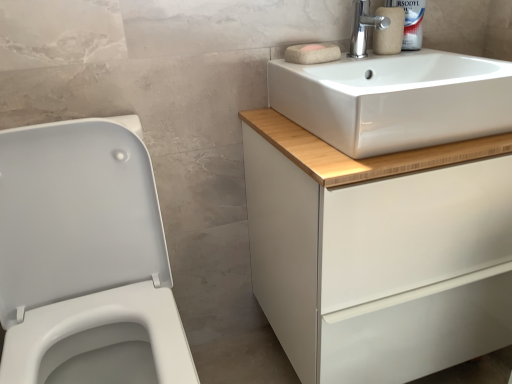
What do you see at coordinates (378, 252) in the screenshot?
I see `white matte cabinet at upper right` at bounding box center [378, 252].

Describe the element at coordinates (411, 22) in the screenshot. The width and height of the screenshot is (512, 384). I see `white glossy plastic bottle at upper right` at that location.

Measure the distance between point (312, 55) and camera.

They are 1.03 meters apart.

This screenshot has width=512, height=384. Describe the element at coordinates (395, 99) in the screenshot. I see `white ceramic sink at upper right` at that location.

This screenshot has width=512, height=384. In order to click on white ceramic sink at upper right in this screenshot , I will do `click(395, 99)`.

Locate an element on the screen. white matte soap at upper center, acting as the 1th soap starting from the back is located at coordinates (312, 47).

Between polished chrome tap at upper right and white ceramic sink at upper right, which one appears on the right side from the viewer's perspective?

From the viewer's perspective, white ceramic sink at upper right appears more on the right side.

Can you confirm if polished chrome tap at upper right is smaller than white ceramic sink at upper right?

Correct, polished chrome tap at upper right occupies less space than white ceramic sink at upper right.

The image size is (512, 384). There is a white ceramic sink at upper right. Find the location of `tap above it (from a real-world perspective)`. tap above it (from a real-world perspective) is located at coordinates (362, 28).

Based on the photo, would you consider matte beige toilet paper at upper right to be distant from white matte soap at upper center, which is the 2th soap from front to back?

They are positioned close to each other.

Which is closer, (392,25) or (320,44)?

Point (392,25)

Is matte beige toilet paper at upper right taller than white matte soap at upper center, acting as the 1th soap starting from the back?

Yes.

Considering the positions of objects matte beige toilet paper at upper right and white matte soap at upper center, which is the 2th soap from front to back, in the image provided, who is more to the right, matte beige toilet paper at upper right or white matte soap at upper center, which is the 2th soap from front to back,?

matte beige toilet paper at upper right is more to the right.

Which is nearer, (310,48) or (412,6)?

The point (310,48) is more forward.

Between white matte soap at upper center, which is the 2th soap from front to back, and white glossy plastic bottle at upper right, which one appears on the right side from the viewer's perspective?

white glossy plastic bottle at upper right is more to the right.

Find the location of a particular element. The image size is (512, 384). cleaning product that is above the white matte soap at upper center, acting as the 1th soap starting from the back (from a real-world perspective) is located at coordinates (411, 22).

Can you tell me how much natural wool soap at upper center, positioned as the 1th soap in front-to-back order, and white glossy porcelain at left differ in facing direction?

They differ by 0.91 degrees in their facing directions.

Choose the correct answer: Is natural wool soap at upper center, which ranks as the 2th soap in back-to-front order, inside white glossy porcelain at left or outside it?

natural wool soap at upper center, which ranks as the 2th soap in back-to-front order, is not enclosed by white glossy porcelain at left.

Where is `porcelain below the natural wool soap at upper center, positioned as the 1th soap in front-to-back order (from the image's perspective)`? porcelain below the natural wool soap at upper center, positioned as the 1th soap in front-to-back order (from the image's perspective) is located at coordinates (85, 259).

Is point (295, 54) less distant than point (45, 200)?

No, (295, 54) is further to viewer.

Is matte beige toilet paper at upper right next to natural wool soap at upper center, which ranks as the 2th soap in back-to-front order?

matte beige toilet paper at upper right and natural wool soap at upper center, which ranks as the 2th soap in back-to-front order, are not in contact.

How many degrees apart are the facing directions of matte beige toilet paper at upper right and natural wool soap at upper center, which ranks as the 2th soap in back-to-front order?

0.0796 degrees separate the facing orientations of matte beige toilet paper at upper right and natural wool soap at upper center, which ranks as the 2th soap in back-to-front order.

From a real-world perspective, is matte beige toilet paper at upper right located higher than natural wool soap at upper center, which ranks as the 2th soap in back-to-front order?

Indeed, from a real-world perspective, matte beige toilet paper at upper right stands above natural wool soap at upper center, which ranks as the 2th soap in back-to-front order.

Is white ceramic sink at upper right looking in the opposite direction of polished chrome tap at upper right?

Yes, white ceramic sink at upper right's orientation is away from polished chrome tap at upper right.

Which object is positioned more to the left, white ceramic sink at upper right or polished chrome tap at upper right?

Positioned to the left is polished chrome tap at upper right.

Is white ceramic sink at upper right smaller than polished chrome tap at upper right?

Actually, white ceramic sink at upper right might be larger than polished chrome tap at upper right.

Is white ceramic sink at upper right inside the boundaries of polished chrome tap at upper right, or outside?

white ceramic sink at upper right exists outside the volume of polished chrome tap at upper right.

Is white ceramic sink at upper right not inside white glossy plastic bottle at upper right?

Yes, white ceramic sink at upper right is outside of white glossy plastic bottle at upper right.

In order to click on cleaning product on the right of white ceramic sink at upper right in this screenshot , I will do `click(411, 22)`.

Is white ceramic sink at upper right thinner than white glossy plastic bottle at upper right?

Incorrect, the width of white ceramic sink at upper right is not less than that of white glossy plastic bottle at upper right.

Is white ceramic sink at upper right bigger or smaller than white glossy plastic bottle at upper right?

Clearly, white ceramic sink at upper right is larger in size than white glossy plastic bottle at upper right.

Identify the location of tap above the white ceramic sink at upper right (from a real-world perspective). The image size is (512, 384). (362, 28).

This screenshot has height=384, width=512. Find the location of `toilet paper above the white matte soap at upper center, acting as the 1th soap starting from the back (from the image's perspective)`. toilet paper above the white matte soap at upper center, acting as the 1th soap starting from the back (from the image's perspective) is located at coordinates (389, 31).

From the image, which object appears to be nearer to white matte soap at upper center, acting as the 1th soap starting from the back, natural wool soap at upper center, which ranks as the 2th soap in back-to-front order, or matte beige toilet paper at upper right?

natural wool soap at upper center, which ranks as the 2th soap in back-to-front order, lies closer to white matte soap at upper center, acting as the 1th soap starting from the back, than the other object.

From the image, which object appears to be farther from matte beige toilet paper at upper right, polished chrome tap at upper right or white matte cabinet at upper right?

white matte cabinet at upper right lies further to matte beige toilet paper at upper right than the other object.

When comparing their distances from natural wool soap at upper center, which ranks as the 2th soap in back-to-front order, does white ceramic sink at upper right or matte beige toilet paper at upper right seem further?

Among the two, white ceramic sink at upper right is located further to natural wool soap at upper center, which ranks as the 2th soap in back-to-front order.

Based on the photo, considering their positions, is polished chrome tap at upper right positioned closer to matte beige toilet paper at upper right than natural wool soap at upper center, which ranks as the 2th soap in back-to-front order?

The object closer to matte beige toilet paper at upper right is polished chrome tap at upper right.

Based on their spatial positions, is white ceramic sink at upper right or white matte cabinet at upper right closer to polished chrome tap at upper right?

white ceramic sink at upper right is positioned closer to the anchor polished chrome tap at upper right.

Based on the photo, based on their spatial positions, is white glossy porcelain at left or natural wool soap at upper center, which ranks as the 2th soap in back-to-front order, further from white matte cabinet at upper right?

natural wool soap at upper center, which ranks as the 2th soap in back-to-front order, lies further to white matte cabinet at upper right than the other object.

Looking at the image, which one is located closer to matte beige toilet paper at upper right, polished chrome tap at upper right or white glossy plastic bottle at upper right?

polished chrome tap at upper right is positioned closer to the anchor matte beige toilet paper at upper right.

Based on their spatial positions, is white glossy plastic bottle at upper right or white matte cabinet at upper right closer to white ceramic sink at upper right?

Among the two, white matte cabinet at upper right is located nearer to white ceramic sink at upper right.

The height and width of the screenshot is (384, 512). Find the location of `bathroom cabinet that lies between matte beige toilet paper at upper right and white glossy porcelain at left from top to bottom`. bathroom cabinet that lies between matte beige toilet paper at upper right and white glossy porcelain at left from top to bottom is located at coordinates (378, 252).

This screenshot has width=512, height=384. I want to click on tap situated between white matte soap at upper center, acting as the 1th soap starting from the back, and white glossy plastic bottle at upper right from left to right, so click(362, 28).

At what (x,y) coordinates should I click in order to perform the action: click on tap between matte beige toilet paper at upper right and white glossy porcelain at left in the vertical direction. Please return your answer as a coordinate pair (x, y). Looking at the image, I should click on (362, 28).

Find the location of `bathroom cabinet between polished chrome tap at upper right and white glossy porcelain at left vertically`. bathroom cabinet between polished chrome tap at upper right and white glossy porcelain at left vertically is located at coordinates (378, 252).